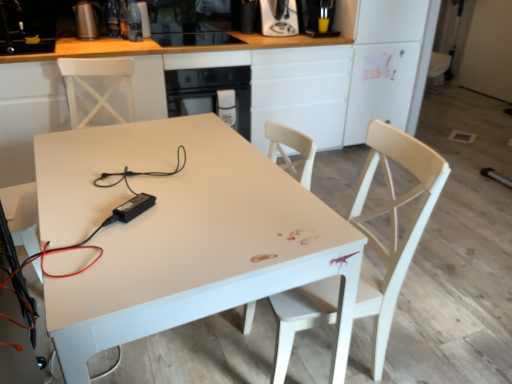
Image resolution: width=512 pixels, height=384 pixels. Identify the location of vacant area that lies to the right of black plastic power adapter at center, the 1th appliance in the right-to-left sequence. (182, 228).